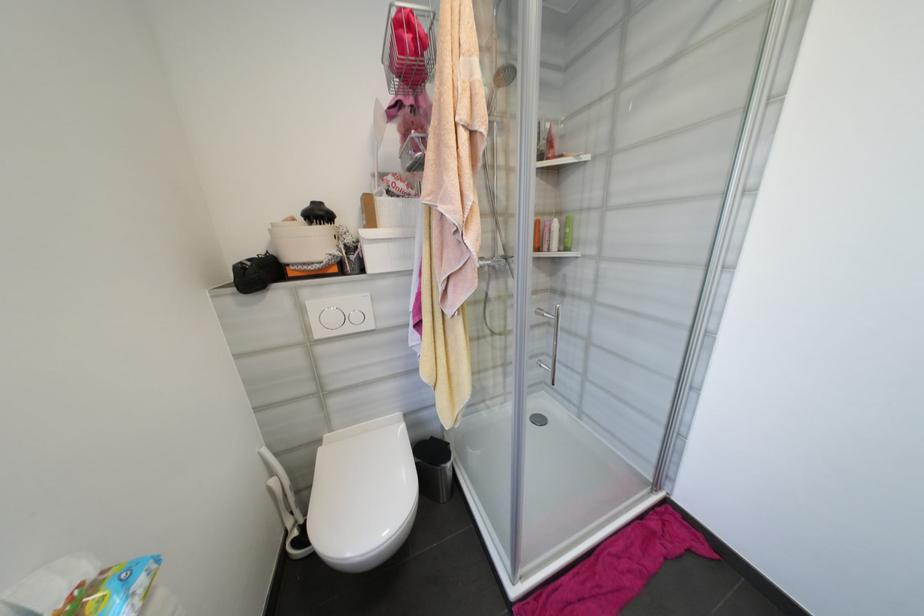
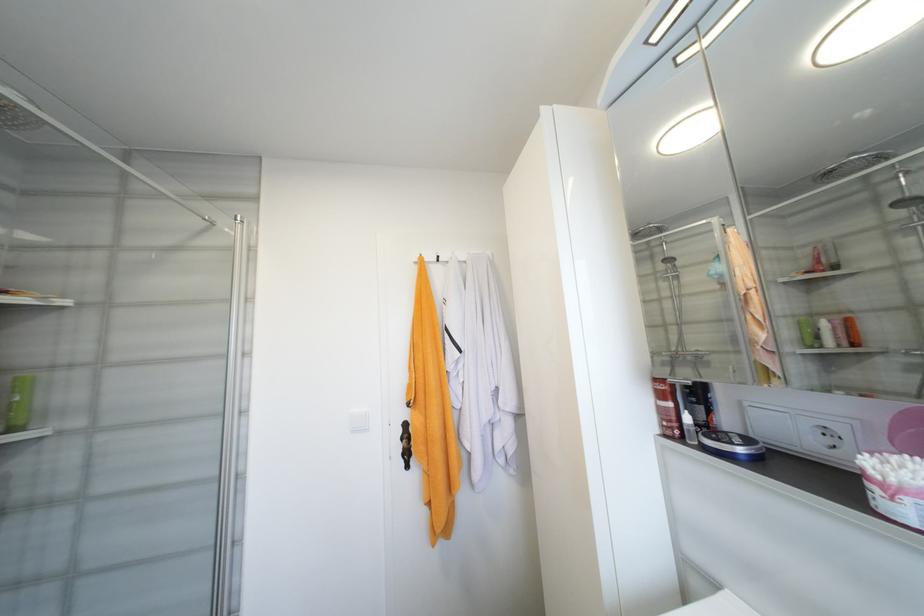
Question: The camera is either moving clockwise (left) or counter-clockwise (right) around the object. The first image is from the beginning of the video and the second image is from the end. Is the camera moving left or right when shooting the video?

Choices:
 (A) Left
 (B) Right

Answer: (A)